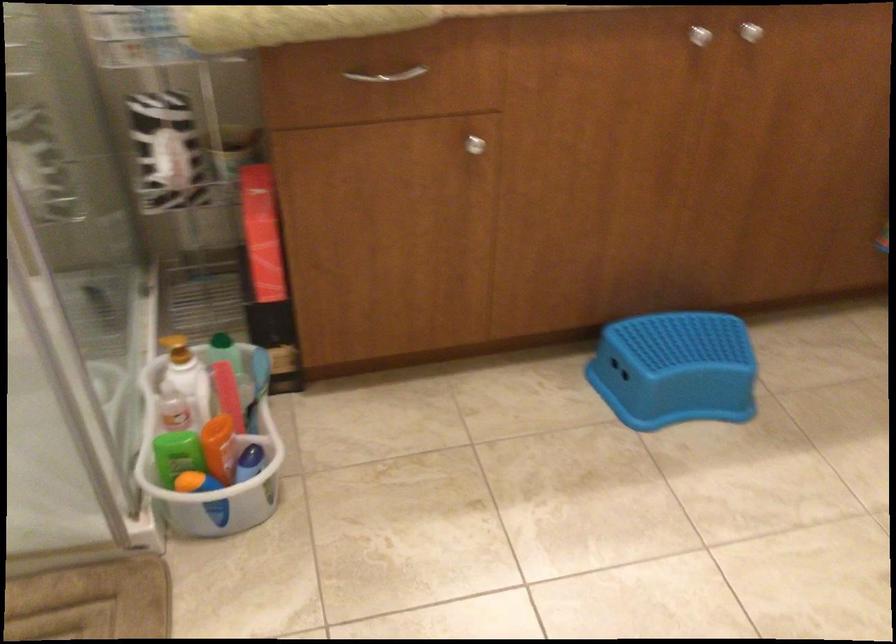
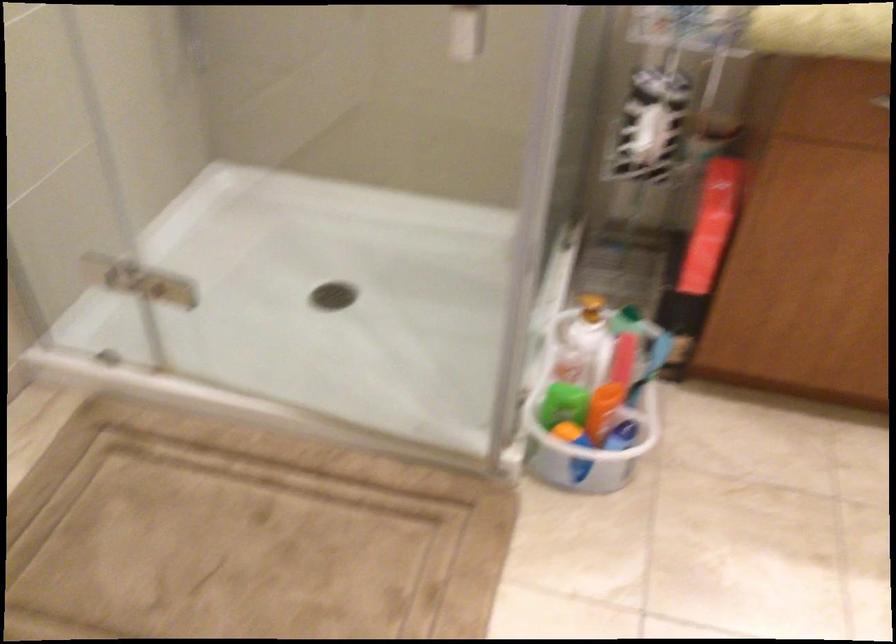
What movement of the cameraman would produce the second image?

The cameraman walked toward left, backward.